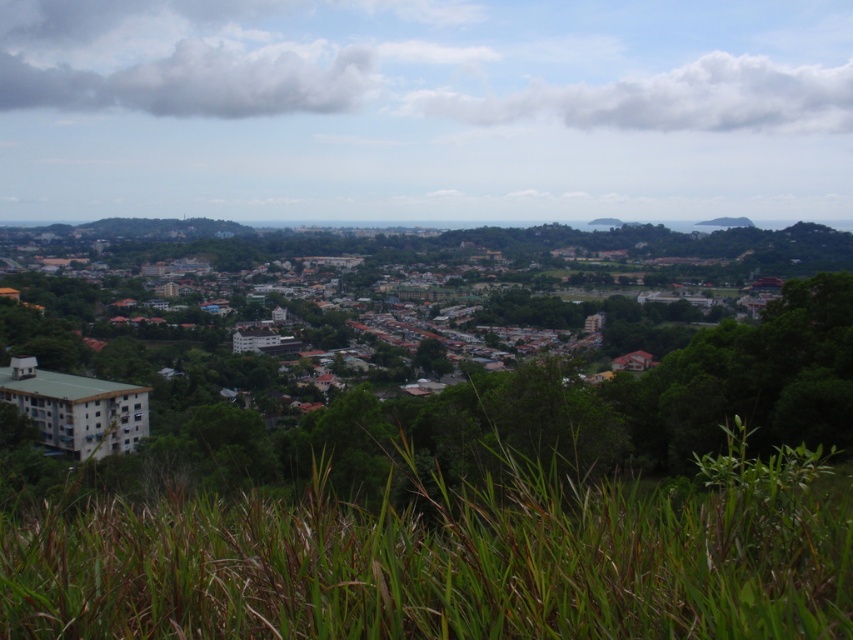
You are a city planner assessing the urban landscape. You notice the white matte building at left and the green grass at lower center. Which of these two elements occupies a higher elevation in the scene?

The white matte building at left has a greater height compared to the green grass at lower center, so it occupies a higher elevation.

You are a city planner analyzing this urban layout. You need to determine if the white matte building at left can be expanded horizontally without encroaching on the green grass at lower center. Based on their widths, what is your assessment?

The white matte building at left is wider than the green grass at lower center. Therefore, expanding the white matte building at left horizontally might not be feasible as it could potentially encroach on the green grass at lower center, which is narrower in width.

You are a drone operator tasked with delivering a package from the white matte building at left to the green grass at lower center. The drone has a maximum flight range of 200 meters. Can the drone complete this delivery without needing a recharge?

The distance between the white matte building at left and the green grass at lower center is 181.37 meters, which is within the drone operator drone has a maximum flight range of 200 meters. Therefore, the drone can complete the delivery without needing a recharge.